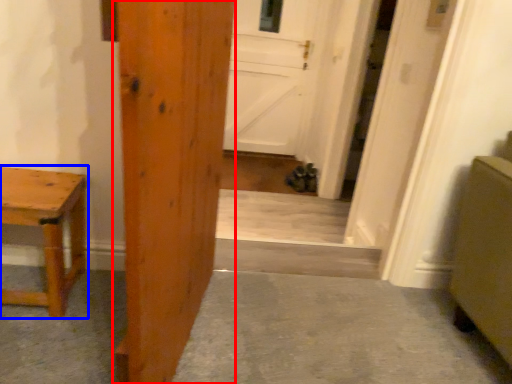
Question: Which of the following is the closest to the observer, door (highlighted by a red box) or table (highlighted by a blue box)?

Choices:
 (A) door
 (B) table

Answer: (A)